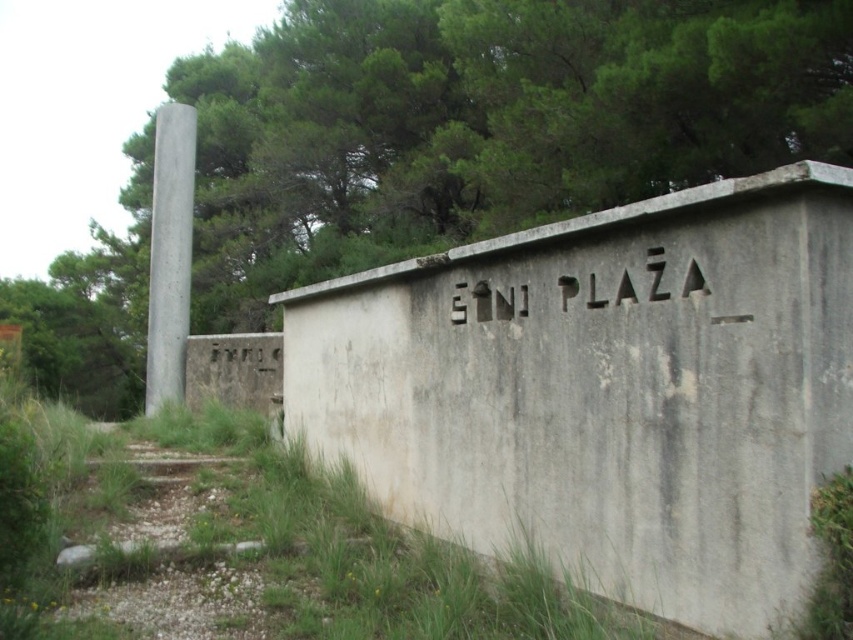
Can you confirm if green leafy tree at upper center is thinner than white concrete sign at upper center?

Incorrect, green leafy tree at upper center's width is not less than white concrete sign at upper center's.

Is point (817, 144) in front of point (599, 307)?

No, (817, 144) is behind (599, 307).

This screenshot has height=640, width=853. Describe the element at coordinates (485, 124) in the screenshot. I see `green leafy tree at upper center` at that location.

At what (x,y) coordinates should I click in order to perform the action: click on green leafy tree at upper center. Please return your answer as a coordinate pair (x, y). Looking at the image, I should click on (485, 124).

Which of these two, green leafy tree at upper center or gray concrete pillar at left, stands taller?

Standing taller between the two is green leafy tree at upper center.

Which is in front, point (136, 326) or point (189, 166)?

Point (189, 166) is in front.

The image size is (853, 640). I want to click on green leafy tree at upper center, so click(485, 124).

Is gray concrete pillar at left wider than white concrete sign at upper center?

Indeed, gray concrete pillar at left has a greater width compared to white concrete sign at upper center.

Can you confirm if gray concrete pillar at left is positioned below white concrete sign at upper center?

No, gray concrete pillar at left is not below white concrete sign at upper center.

Does point (160, 372) come closer to viewer compared to point (692, 284)?

No, it is behind (692, 284).

Where is `gray concrete pillar at left`? This screenshot has height=640, width=853. gray concrete pillar at left is located at coordinates (169, 253).